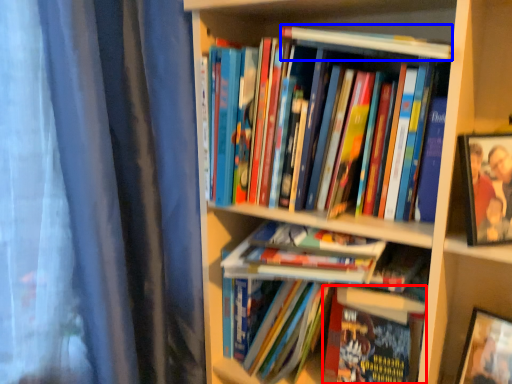
Question: Which object is further to the camera taking this photo, book (highlighted by a red box) or book (highlighted by a blue box)?

Choices:
 (A) book
 (B) book

Answer: (A)